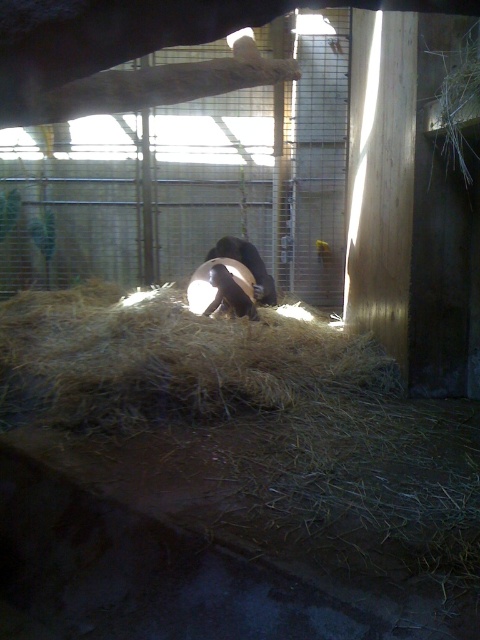
You are a zookeeper preparing to clean the enclosure. You need to move the brown fuzzy bear at center to a different area before cleaning the brown dry hay at center. Based on their sizes, which object should you prioritize moving first?

The brown fuzzy bear at center is smaller than the brown dry hay at center, so you should move the brown fuzzy bear at center first since it is easier to relocate before tackling the larger hay pile.

You are a zookeeper trying to place a new feeding tray in the enclosure. The tray must be placed between the two points, point (238,288) and point (265,298). Since the tray needs to be placed closer to the camera, which point should you use as the reference for placement?

Point (238,288) is closer to the camera than point (265,298), so you should use point (238,288) as the reference for placing the feeding tray closer to the camera.

You are a zookeeper who needs to ensure the brown fur monkey at center has enough space to move around. Given that the brown dry hay at center takes up more horizontal space than the monkey, is the area between them sufficient for the monkey to move freely?

The brown dry hay at center has a larger width than the brown fur monkey at center, so the space between them might be sufficient for the monkey to move freely as the hay does not block the entire area.